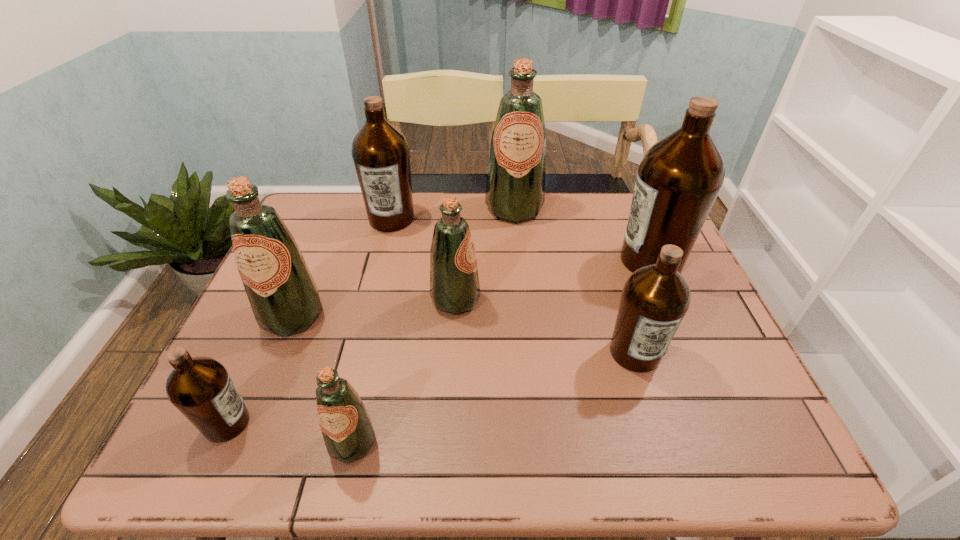
Where is `the farthest green olive oil`? This screenshot has width=960, height=540. the farthest green olive oil is located at coordinates (515, 191).

Locate an element on the screen. the third object from right to left is located at coordinates (515, 191).

Image resolution: width=960 pixels, height=540 pixels. Find the location of `the biggest brown olive oil`. the biggest brown olive oil is located at coordinates (679, 178).

Locate an element on the screen. the second biggest brown olive oil is located at coordinates (380, 152).

The height and width of the screenshot is (540, 960). I want to click on the third brown olive oil from right to left, so click(380, 152).

Image resolution: width=960 pixels, height=540 pixels. Identify the location of the leftmost green olive oil. (284, 298).

Find the location of a particular element. This screenshot has height=540, width=960. the fifth olive oil from left to right is located at coordinates (454, 282).

Identify the location of the second smallest green olive oil. pyautogui.click(x=454, y=282).

Where is `the third farthest brown olive oil`? the third farthest brown olive oil is located at coordinates (655, 298).

I want to click on the nearest green olive oil, so click(x=348, y=433).